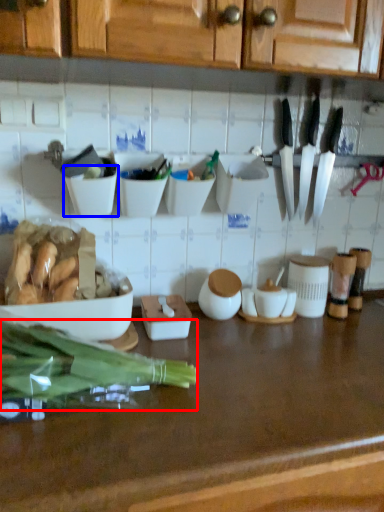
Question: Which of the following is the closest to the observer, green vegetables (highlighted by a red box) or bowl (highlighted by a blue box)?

Choices:
 (A) green vegetables
 (B) bowl

Answer: (A)